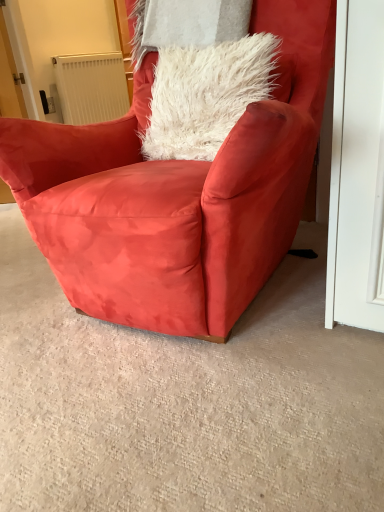
Question: Do you think white plastic radiator at upper left is within suede red armchair at center, or outside of it?

Choices:
 (A) outside
 (B) inside

Answer: (A)

Question: Considering the positions of white plastic radiator at upper left and suede red armchair at center in the image, is white plastic radiator at upper left bigger or smaller than suede red armchair at center?

Choices:
 (A) big
 (B) small

Answer: (B)

Question: From the image's perspective, relative to suede red armchair at center, is white plastic radiator at upper left above or below?

Choices:
 (A) below
 (B) above

Answer: (B)

Question: From the image's perspective, is suede red armchair at center above or below white plastic radiator at upper left?

Choices:
 (A) above
 (B) below

Answer: (B)

Question: Would you say suede red armchair at center is to the left or to the right of white plastic radiator at upper left in the picture?

Choices:
 (A) right
 (B) left

Answer: (A)

Question: Is suede red armchair at center inside or outside of white plastic radiator at upper left?

Choices:
 (A) outside
 (B) inside

Answer: (A)

Question: Does point (249, 224) appear closer or farther from the camera than point (100, 72)?

Choices:
 (A) closer
 (B) farther

Answer: (A)